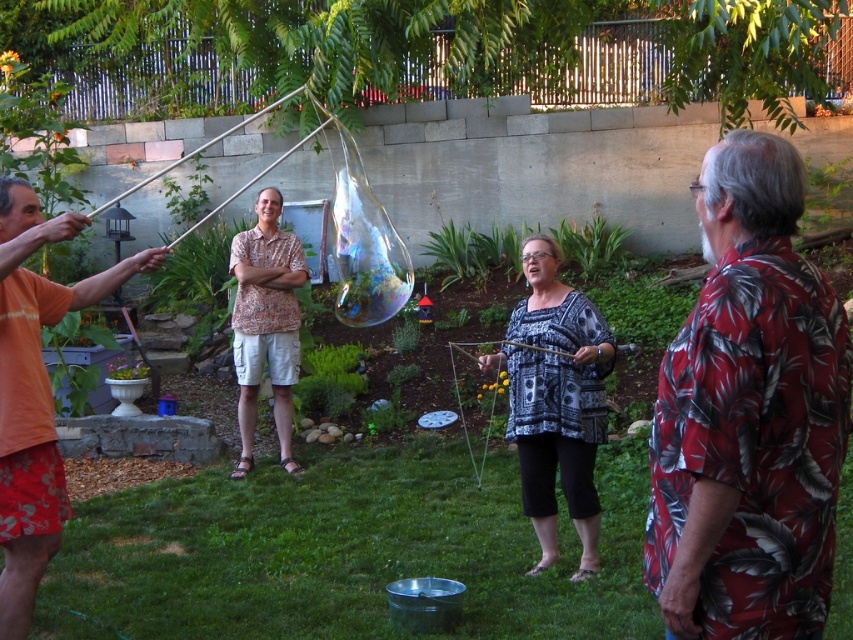
Does red floral shirt at right have a greater height compared to printed fabric shirt at center?

In fact, red floral shirt at right may be shorter than printed fabric shirt at center.

Can you confirm if red floral shirt at right is thinner than printed fabric shirt at center?

Yes, red floral shirt at right is thinner than printed fabric shirt at center.

Locate an element on the screen. red floral shirt at right is located at coordinates (x=749, y=413).

At what (x,y) coordinates should I click in order to perform the action: click on red floral shirt at right. Please return your answer as a coordinate pair (x, y). The height and width of the screenshot is (640, 853). Looking at the image, I should click on (749, 413).

Who is higher up, patterned fabric blouse at center or printed fabric shirt at center?

Positioned higher is printed fabric shirt at center.

Is patterned fabric blouse at center above printed fabric shirt at center?

Incorrect, patterned fabric blouse at center is not positioned above printed fabric shirt at center.

Who is more distant from viewer, (543, 237) or (279, 396)?

The point (279, 396) is behind.

At what (x,y) coordinates should I click in order to perform the action: click on patterned fabric blouse at center. Please return your answer as a coordinate pair (x, y). This screenshot has width=853, height=640. Looking at the image, I should click on pos(556,401).

Locate an element on the screen. The height and width of the screenshot is (640, 853). orange tie-dye shirt at left is located at coordinates (33, 392).

Does orange tie-dye shirt at left appear under patterned fabric blouse at center?

Incorrect, orange tie-dye shirt at left is not positioned below patterned fabric blouse at center.

At what (x,y) coordinates should I click in order to perform the action: click on orange tie-dye shirt at left. Please return your answer as a coordinate pair (x, y). The height and width of the screenshot is (640, 853). Looking at the image, I should click on (33, 392).